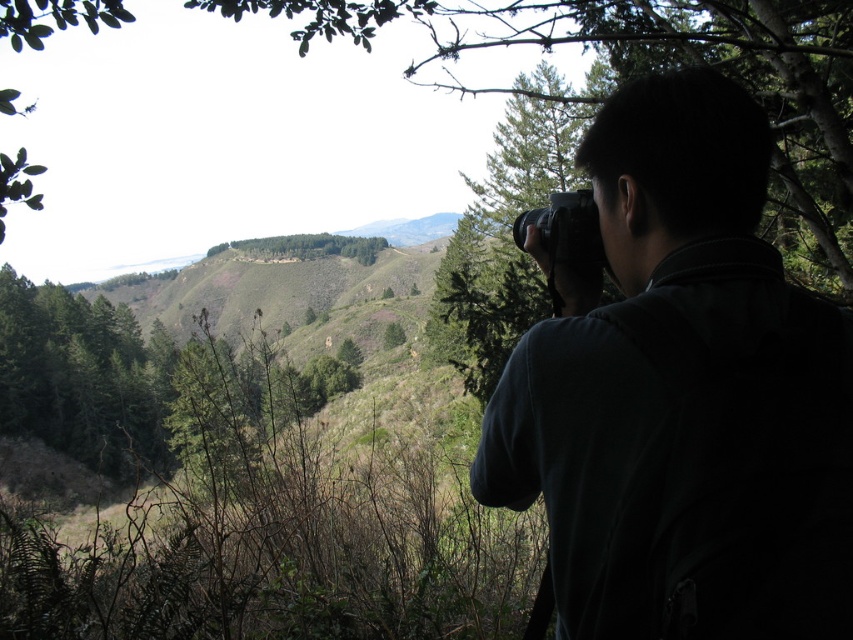
Question: Which point is closer to the camera?

Choices:
 (A) green textured tree at upper right
 (B) green leafy trees at center
 (C) black plastic camera at upper right

Answer: (C)

Question: Among these points, which one is nearest to the camera?

Choices:
 (A) (244, 241)
 (B) (630, 161)

Answer: (B)

Question: Is dark fabric camera at right positioned in front of green leafy trees at center?

Choices:
 (A) no
 (B) yes

Answer: (B)

Question: Considering the relative positions of dark fabric camera at right and black plastic camera at upper right in the image provided, where is dark fabric camera at right located with respect to black plastic camera at upper right?

Choices:
 (A) below
 (B) above

Answer: (A)

Question: Is the position of green textured tree at upper right more distant than that of green leafy trees at center?

Choices:
 (A) no
 (B) yes

Answer: (A)

Question: Among these points, which one is nearest to the camera?

Choices:
 (A) (583, 429)
 (B) (508, 280)

Answer: (A)